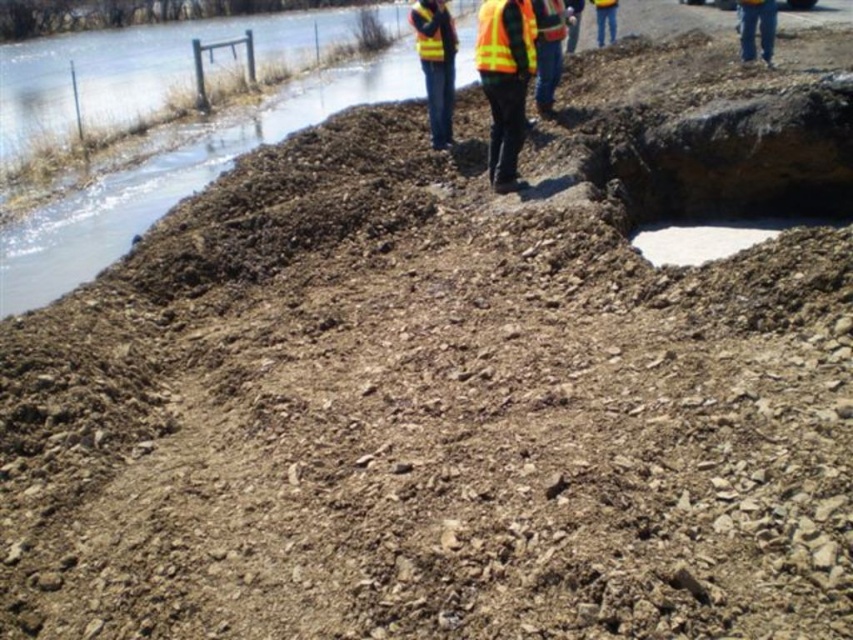
You are a delivery person trying to navigate through the construction site. You see the white smooth concrete at center and the yellow reflective safety vest at upper center. Which object is taller from your viewpoint?

The white smooth concrete at center is taller than the yellow reflective safety vest at upper center according to the description.

You are a construction worker who just arrived at the site. You see the yellow reflective vest at center and the yellow reflective safety vest at upper center. Which one is higher up in the image?

The yellow reflective safety vest at upper center is higher up in the image than the yellow reflective vest at center.

You are a safety inspector at the construction site. You need to walk from the white smooth concrete at center to the yellow reflective safety vest at upper center. Is the path between them clear of obstacles?

The white smooth concrete at center is closer to the viewer than the yellow reflective safety vest at upper center, so the path between them is clear of obstacles.